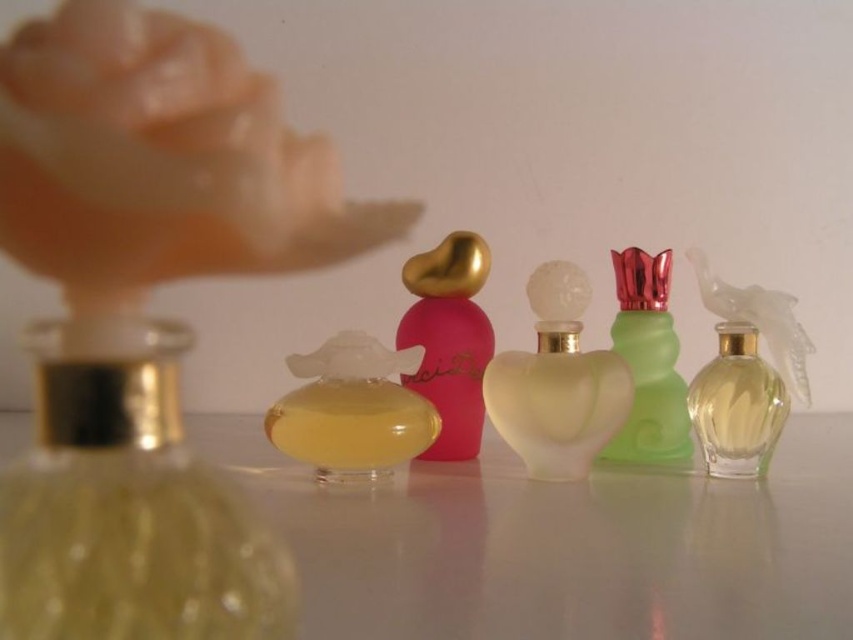
You are arranging perfume bottles on a table and see the translucent yellow glass at left and the translucent yellow glass at center. Which one is positioned more to the left?

The translucent yellow glass at left is positioned more to the left than the translucent yellow glass at center.

You are a customer at a perfume store and want to choose between the pink glossy perfume at center and the green frosted glass perfume at center right. Which one is taller?

The pink glossy perfume at center is much taller than the green frosted glass perfume at center right.